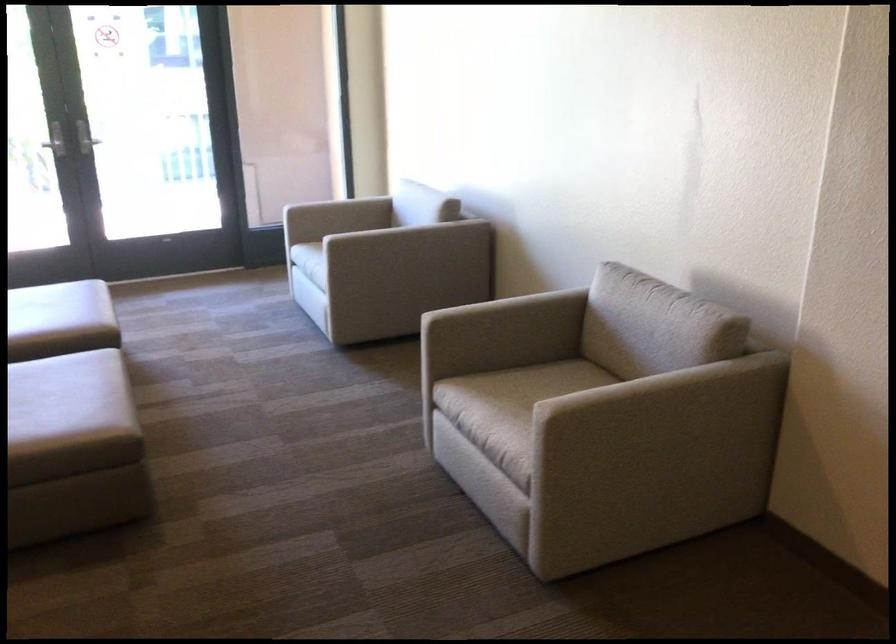
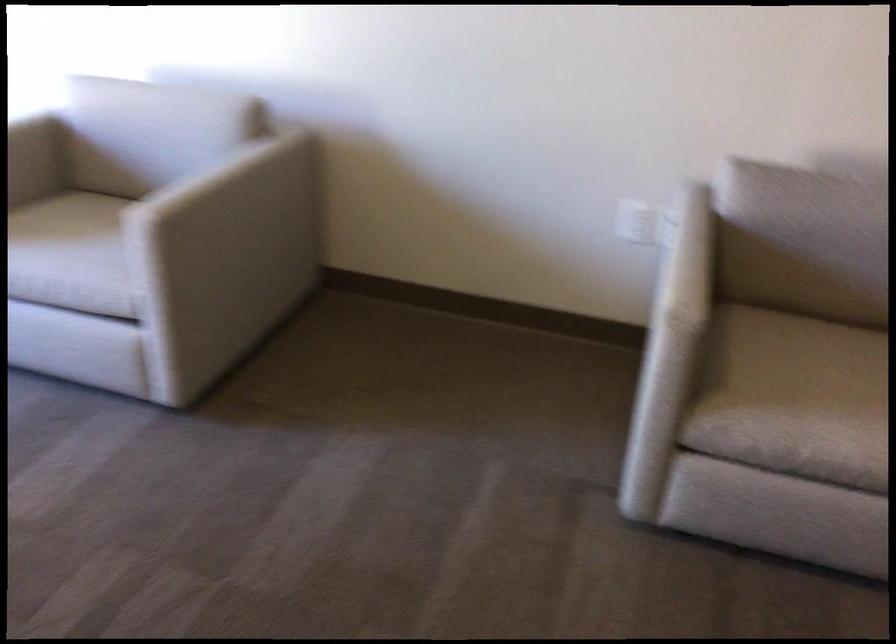
The point at (485, 301) is marked in the first image. Where is the corresponding point in the second image?

(685, 259)